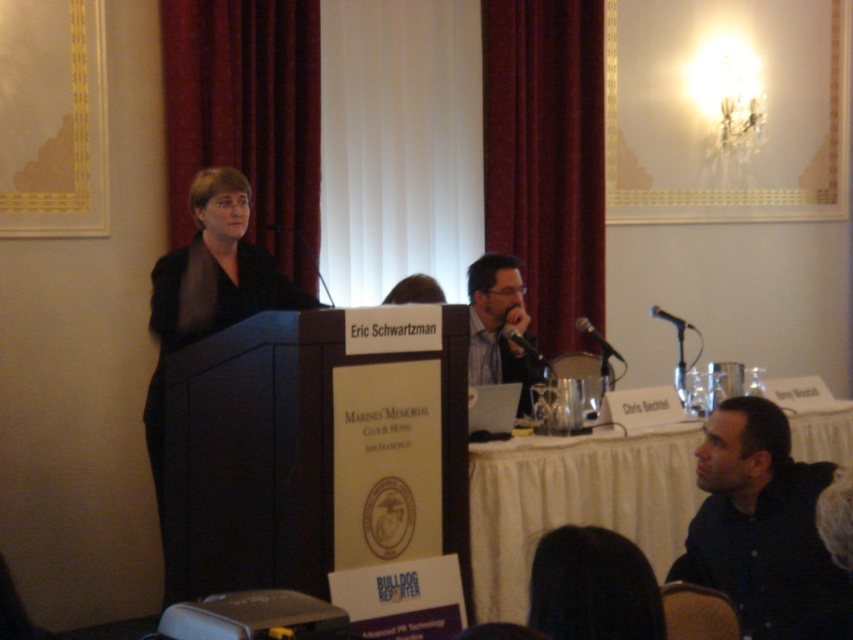
Question: Does matte black shirt at center appear on the right side of metallic silver microphone at upper right?

Choices:
 (A) yes
 (B) no

Answer: (B)

Question: Where is white cloth-covered table at lower right located in relation to matte black shirt at center in the image?

Choices:
 (A) right
 (B) left

Answer: (A)

Question: Which object is the farthest from the black fabric at left?

Choices:
 (A) black plastic microphone at center
 (B) metallic silver microphone at upper right
 (C) burgundy velvet curtain at center

Answer: (B)

Question: Considering the real-world distances, which object is closest to the dark red velvet curtain at upper center?

Choices:
 (A) matte black shirt at center
 (B) dark brown hair at lower center

Answer: (A)

Question: Which point is farther to the camera?

Choices:
 (A) matte black shirt at center
 (B) black plastic microphone at center

Answer: (B)

Question: Is dark brown hair at lower center positioned in front of black metallic microphone at center?

Choices:
 (A) yes
 (B) no

Answer: (A)